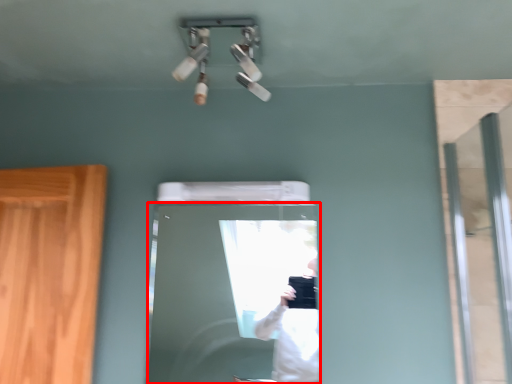
Question: From the image's perspective, where is door (annotated by the red box) located relative to screen door?

Choices:
 (A) above
 (B) below

Answer: (B)